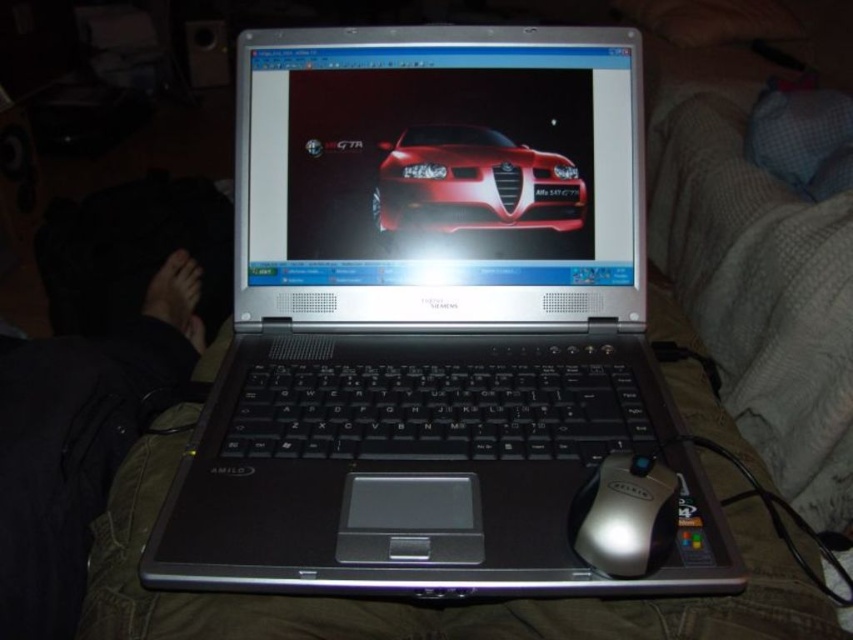
You are a delivery robot that needs to place a package between the glossy red car at center and the silver metallic mouse at center. The package is 10 inches long. Can you fit it between them without moving either object?

The glossy red car at center is 11.13 inches away from the silver metallic mouse at center. Since the package is 10 inches long, it can fit between them as the distance is sufficient.

What is located at the coordinates point (473, 182) in the image?

The point (473, 182) indicates a glossy red car at center.